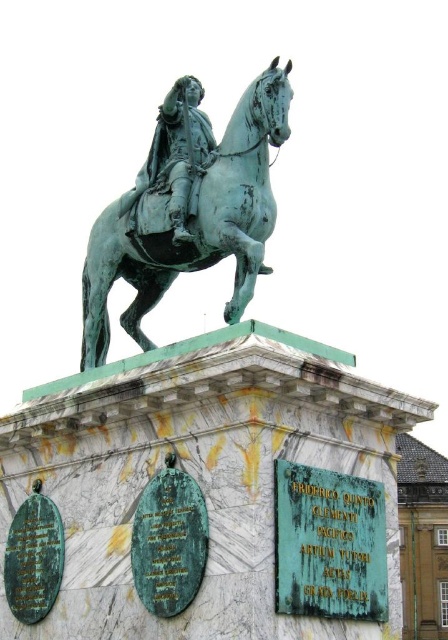
You are an art conservator examining the equestrian statue. You need to clean the green patina horse at center and the green patina statue at center. Which one should you clean first if you want to start with the part that is closer to you?

The green patina horse at center is in front of the green patina statue at center, so you should clean the green patina horse at center first since it is closer to you.